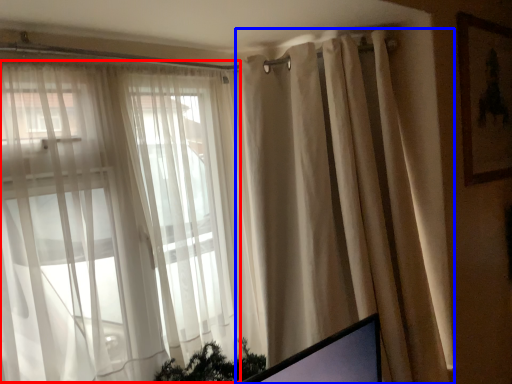
Question: Which object is closer to the camera taking this photo, bay window (highlighted by a red box) or curtain (highlighted by a blue box)?

Choices:
 (A) bay window
 (B) curtain

Answer: (A)